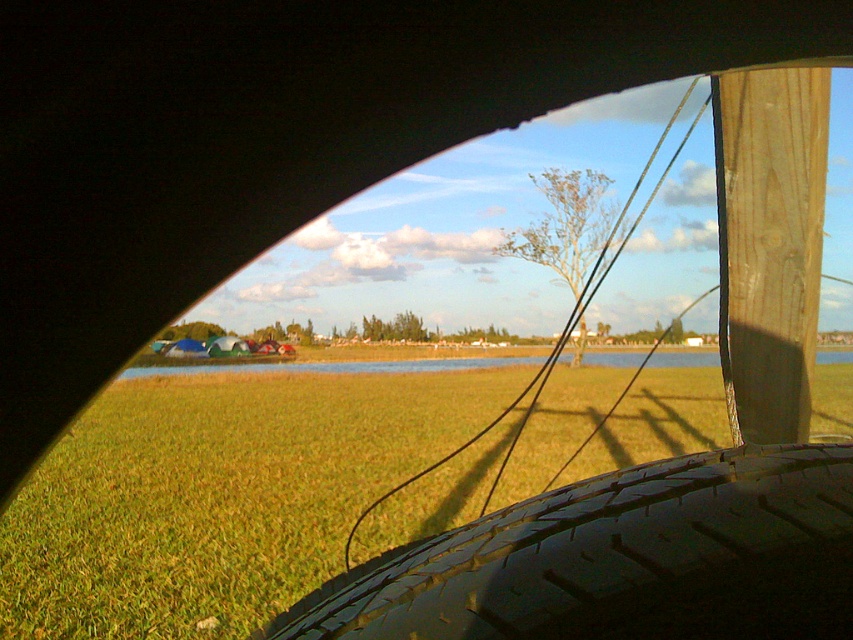
You are a photographer standing 1.06 meters away from the camera. You want to take a photo of the green grass at lower left. Can you reach the camera to adjust it without moving your position?

Since you are 1.06 meters away from the camera and the green grass at lower left is also 1.06 meters away from the camera, you can reach the camera to adjust it without moving your position.

In the scene shown: You are a passenger in the vehicle and notice the black rubber tire at lower right and the wooden post at upper right outside. Which object appears taller in the scene?

The wooden post at upper right appears taller than the black rubber tire at lower right.

You are a delivery robot with a 1.2 meter long arm. You need to reach the wooden post at upper right from the black rubber tire at lower right. Can your arm reach it?

The distance between the black rubber tire at lower right and the wooden post at upper right is 1.05 meters. Since your arm is 1.2 meters long, it can reach the wooden post at upper right.